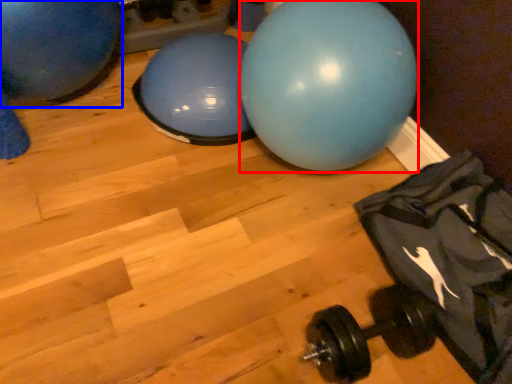
Question: Which object appears closest to the camera in this image, ball (highlighted by a red box) or ball (highlighted by a blue box)?

Choices:
 (A) ball
 (B) ball

Answer: (A)